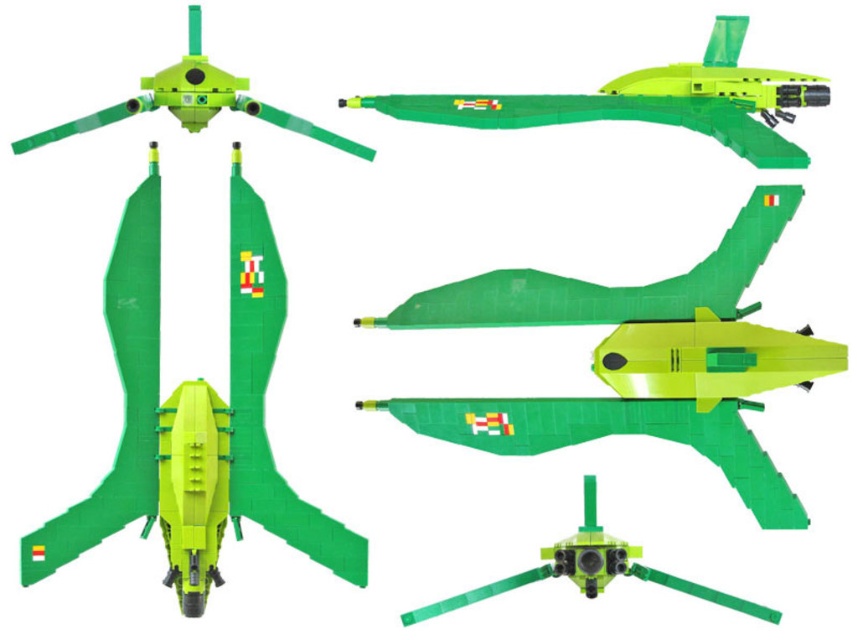
You are a toy collector who wants to display the matte green plastic helicopter at bottom and the matte plastic drone at upper left on a shelf. If the shelf has a height limit of 15 cm, can both fit without exceeding the limit?

The matte green plastic helicopter at bottom is taller than the matte plastic drone at upper left. Since the helicopter is taller, but the exact height isn

You are standing 5 feet away from the camera. Can you reach the matte plastic drone at upper left without moving?

The matte plastic drone at upper left is 4.83 feet from the camera. Since you are standing 5 feet away from the camera, you are slightly farther than the drone, so you cannot reach it without moving closer.